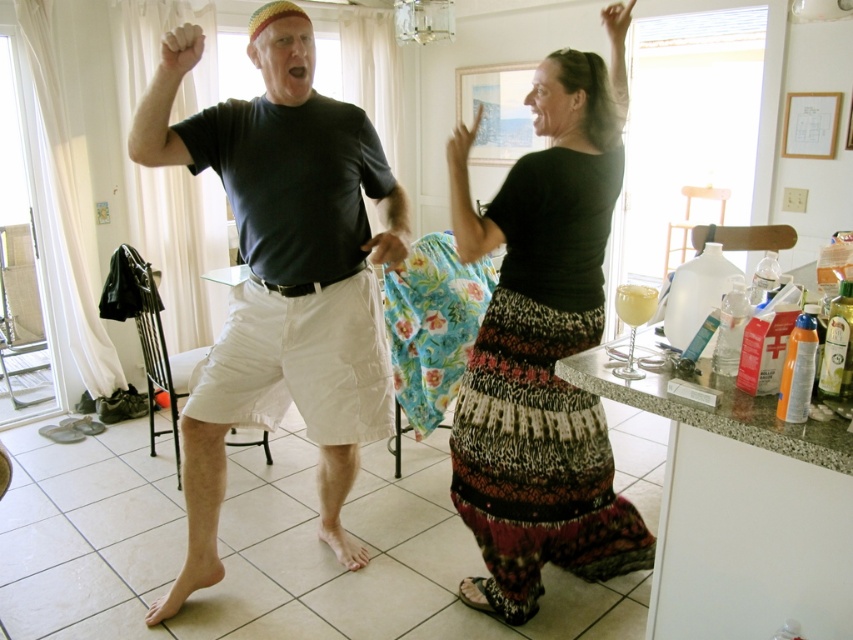
Consider the image. Can you confirm if matte black t-shirt at center is positioned to the right of black textured skirt at center?

No, matte black t-shirt at center is not to the right of black textured skirt at center.

Is matte black t-shirt at center shorter than black textured skirt at center?

Correct, matte black t-shirt at center is not as tall as black textured skirt at center.

Between point (303, 406) and point (611, 61), which one is positioned behind?

The point (611, 61) is behind.

What are the coordinates of `matte black t-shirt at center` in the screenshot? It's located at (282, 273).